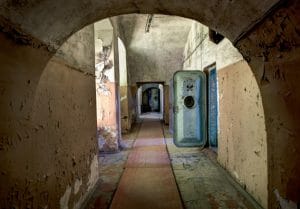
At what (x,y) coordinates should I click in order to perform the action: click on window. Please return your answer as a coordinate pair (x, y). Image resolution: width=300 pixels, height=209 pixels. Looking at the image, I should click on (189, 101).